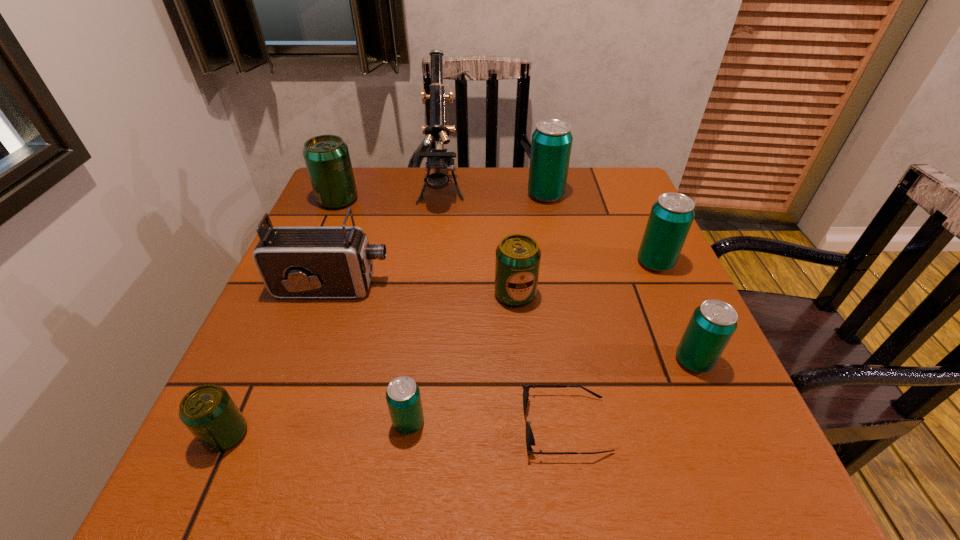
This screenshot has width=960, height=540. Find the location of `microscope`. microscope is located at coordinates (437, 158).

The height and width of the screenshot is (540, 960). In order to click on the second teal beer can from left to right in this screenshot , I will do `click(551, 145)`.

Locate an element on the screen. the third beer can from right to left is located at coordinates (551, 145).

Locate an element on the screen. This screenshot has height=540, width=960. camcorder is located at coordinates (294, 262).

The image size is (960, 540). Find the location of `the biggest green beer can`. the biggest green beer can is located at coordinates (327, 159).

Locate an element on the screen. the third smallest teal beer can is located at coordinates (671, 216).

Where is `the second farthest teal beer can`? Image resolution: width=960 pixels, height=540 pixels. the second farthest teal beer can is located at coordinates (671, 216).

Where is `the rightmost green beer can`? the rightmost green beer can is located at coordinates (517, 262).

Locate an element on the screen. This screenshot has height=540, width=960. the fourth nearest beer can is located at coordinates (517, 262).

What are the coordinates of `the third nearest beer can` in the screenshot? It's located at (713, 323).